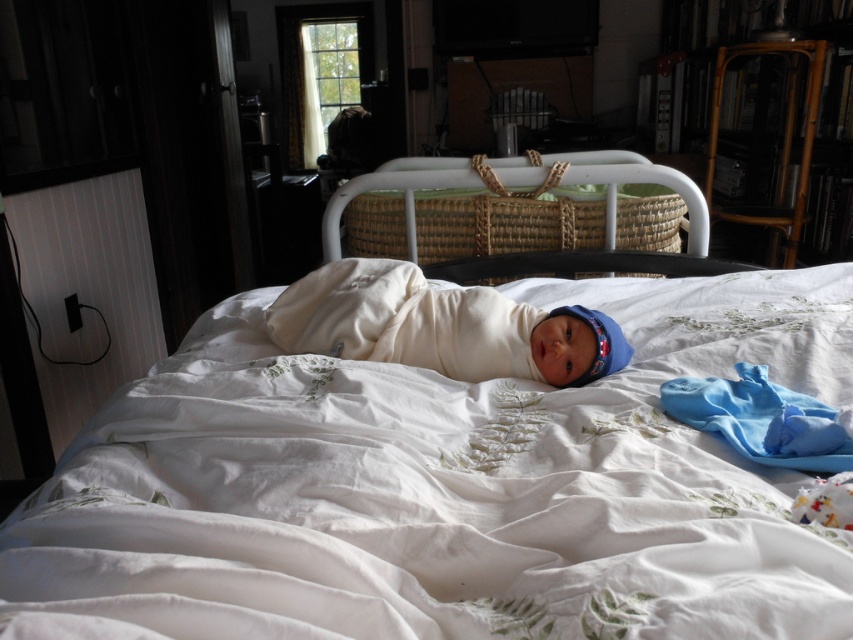
You are a parent trying to place a new decorative item on the white embroidered sheet at center. The item is 1.2 meters wide. Can you fit it on the sheet without overlapping the bamboo bookshelf at upper right?

The white embroidered sheet at center might be wider than bamboo bookshelf at upper right. However, since the exact width of the sheet isn

Based on the photo, you are a parent trying to place a new stuffed animal between the white embroidered sheet at center and the woven wicker bassinet at center. Can you fit the stuffed animal in between them?

The white embroidered sheet at center is taller than the woven wicker bassinet at center, so there might be enough vertical space to place the stuffed animal between them. However, the horizontal distance between the two objects isn